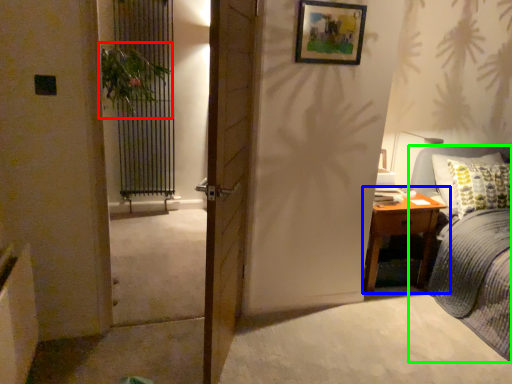
Question: Based on their relative distances, which object is farther from plant (highlighted by a red box)? Choose from nightstand (highlighted by a blue box) and bed (highlighted by a green box).

Choices:
 (A) nightstand
 (B) bed

Answer: (B)